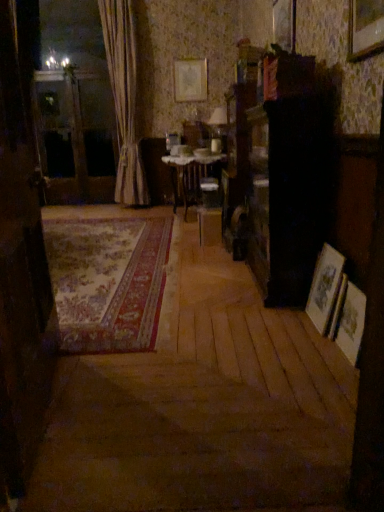
Question: Can you confirm if white textured curtain at left is bigger than wooden picture frame at upper center, which is the third picture frame from front to back?

Choices:
 (A) yes
 (B) no

Answer: (A)

Question: From a real-world perspective, is white textured curtain at left under wooden picture frame at upper center, which appears as the third picture frame when ordered from the bottom?

Choices:
 (A) yes
 (B) no

Answer: (A)

Question: From the image's perspective, is white textured curtain at left above wooden picture frame at upper center, marked as the 3th picture frame in a left-to-right arrangement?

Choices:
 (A) yes
 (B) no

Answer: (A)

Question: From a real-world perspective, is white textured curtain at left positioned over wooden picture frame at upper center, marked as the 2th picture frame in a right-to-left arrangement, based on gravity?

Choices:
 (A) yes
 (B) no

Answer: (B)

Question: Does white textured curtain at left appear on the right side of wooden picture frame at upper center, the 2th picture frame in the back-to-front sequence?

Choices:
 (A) yes
 (B) no

Answer: (B)

Question: Is the depth of white textured curtain at left less than that of wooden picture frame at upper center, which appears as the third picture frame when ordered from the bottom?

Choices:
 (A) yes
 (B) no

Answer: (B)

Question: Is carpeted rug at center at the right side of white lace table at center?

Choices:
 (A) yes
 (B) no

Answer: (B)

Question: Can you confirm if carpeted rug at center is shorter than white lace table at center?

Choices:
 (A) yes
 (B) no

Answer: (A)

Question: Is carpeted rug at center far from white lace table at center?

Choices:
 (A) no
 (B) yes

Answer: (B)

Question: Is carpeted rug at center closer to the viewer compared to white lace table at center?

Choices:
 (A) no
 (B) yes

Answer: (B)

Question: Is carpeted rug at center placed right next to white lace table at center?

Choices:
 (A) yes
 (B) no

Answer: (B)

Question: Is carpeted rug at center to the left of white lace table at center from the viewer's perspective?

Choices:
 (A) yes
 (B) no

Answer: (A)

Question: Is matte gold picture frame at upper center, the fourth picture frame from the bottom, oriented away from transparent glass screen door at left, which is counted as the second screen door, starting from the right?

Choices:
 (A) no
 (B) yes

Answer: (A)